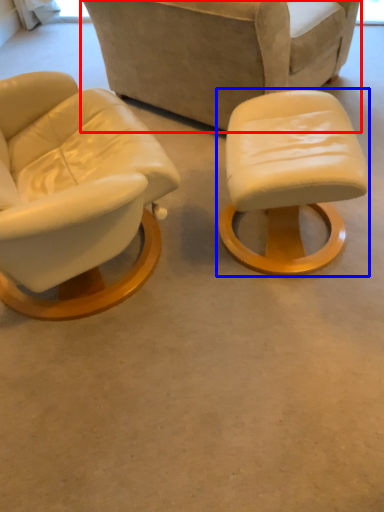
Question: Which of the following is the closest to the observer, chair (highlighted by a red box) or stool (highlighted by a blue box)?

Choices:
 (A) chair
 (B) stool

Answer: (B)